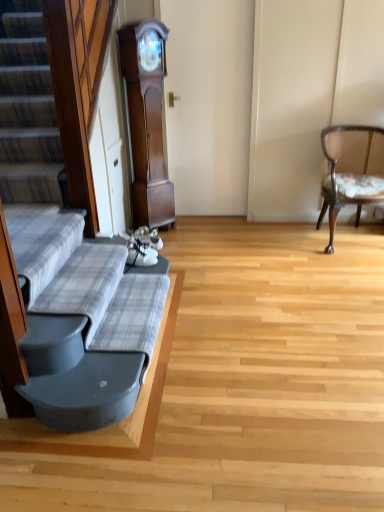
This screenshot has height=512, width=384. Find the location of `free point to the right of plaid fabric couch at left`. free point to the right of plaid fabric couch at left is located at coordinates (252, 357).